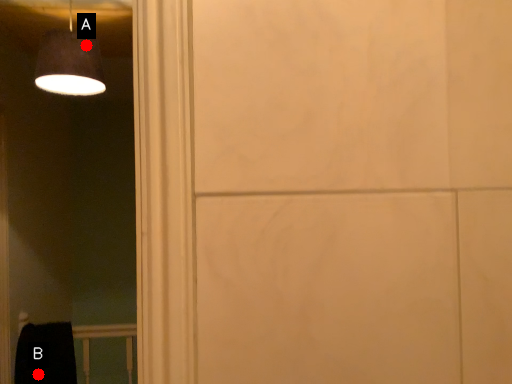
Question: Two points are circled on the image, labeled by A and B beside each circle. Which point appears farthest from the camera in this image?

Choices:
 (A) A is further
 (B) B is further

Answer: (B)